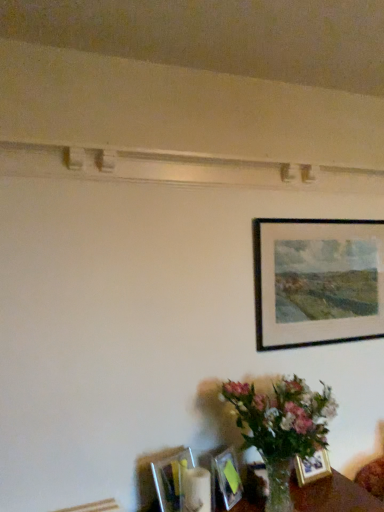
Question: Is black matte picture frame at upper right, which is the 1th picture frame in right-to-left order, at the back of matte glass picture frame at lower center, the 3th picture frame in the top-to-bottom sequence?

Choices:
 (A) yes
 (B) no

Answer: (B)

Question: Is the surface of matte glass picture frame at lower center, the second picture frame in the left-to-right sequence, in direct contact with black matte picture frame at upper right, which ranks as the 4th picture frame in bottom-to-top order?

Choices:
 (A) yes
 (B) no

Answer: (B)

Question: Does matte glass picture frame at lower center, which is the third picture frame in right-to-left order, turn towards black matte picture frame at upper right, which is the 1th picture frame in right-to-left order?

Choices:
 (A) yes
 (B) no

Answer: (B)

Question: Is matte glass picture frame at lower center, which is the third picture frame in right-to-left order, positioned beyond the bounds of black matte picture frame at upper right, which ranks as the 4th picture frame in bottom-to-top order?

Choices:
 (A) yes
 (B) no

Answer: (A)

Question: Is matte glass picture frame at lower center, the second picture frame in the left-to-right sequence, shorter than black matte picture frame at upper right, placed as the 4th picture frame when sorted from left to right?

Choices:
 (A) no
 (B) yes

Answer: (B)

Question: Considering their positions, is matte glass picture frame at lower center, the 3th picture frame in the top-to-bottom sequence, located in front of or behind gold metallic picture frame at lower right, which is the 4th picture frame in top-to-bottom order?

Choices:
 (A) behind
 (B) front

Answer: (B)

Question: Is matte glass picture frame at lower center, which is the third picture frame in right-to-left order, to the left or to the right of gold metallic picture frame at lower right, the 1th picture frame positioned from the bottom, in the image?

Choices:
 (A) left
 (B) right

Answer: (A)

Question: Is matte glass picture frame at lower center, which ranks as the second picture frame in bottom-to-top order, situated inside gold metallic picture frame at lower right, the 1th picture frame positioned from the bottom, or outside?

Choices:
 (A) inside
 (B) outside

Answer: (B)

Question: Is matte glass picture frame at lower center, the second picture frame in the left-to-right sequence, taller or shorter than gold metallic picture frame at lower right, the 1th picture frame positioned from the bottom?

Choices:
 (A) tall
 (B) short

Answer: (A)

Question: Is gold metallic picture frame at lower right, the 1th picture frame positioned from the bottom, in front of or behind black matte picture frame at upper right, placed as the 4th picture frame when sorted from left to right, in the image?

Choices:
 (A) front
 (B) behind

Answer: (A)

Question: Choose the correct answer: Is gold metallic picture frame at lower right, which is the 4th picture frame in top-to-bottom order, inside black matte picture frame at upper right, placed as the 4th picture frame when sorted from left to right, or outside it?

Choices:
 (A) outside
 (B) inside

Answer: (A)

Question: Based on their positions, is gold metallic picture frame at lower right, which is the 4th picture frame in top-to-bottom order, located to the left or right of black matte picture frame at upper right, placed as the 4th picture frame when sorted from left to right?

Choices:
 (A) left
 (B) right

Answer: (A)

Question: From a real-world perspective, is gold metallic picture frame at lower right, which is the 4th picture frame in top-to-bottom order, positioned above or below black matte picture frame at upper right, marked as the first picture frame in a top-to-bottom arrangement?

Choices:
 (A) above
 (B) below

Answer: (B)

Question: From a real-world perspective, relative to gold metallic picture frame at lower right, which is the 4th picture frame in top-to-bottom order, is metallic silver picture frame at lower center, the 3th picture frame positioned from the bottom, vertically above or below?

Choices:
 (A) above
 (B) below

Answer: (A)

Question: Choose the correct answer: Is metallic silver picture frame at lower center, which is counted as the fourth picture frame, starting from the right, inside gold metallic picture frame at lower right, which is the 4th picture frame in top-to-bottom order, or outside it?

Choices:
 (A) inside
 (B) outside

Answer: (B)